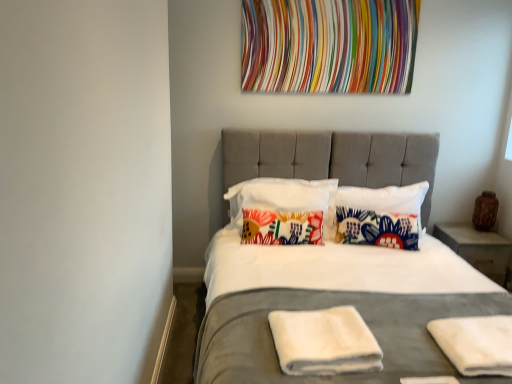
Question: From the image's perspective, would you say white towel at center, which is counted as the 1th material, starting from the left, is positioned over white cotton pillow at center, which is the third pillow in right-to-left order?

Choices:
 (A) no
 (B) yes

Answer: (A)

Question: Does white towel at center, arranged as the second material when viewed from the right, turn towards white cotton pillow at center, the 2th pillow when ordered from left to right?

Choices:
 (A) no
 (B) yes

Answer: (A)

Question: Considering the relative sizes of white towel at center, arranged as the second material when viewed from the right, and white cotton pillow at center, the 2th pillow when ordered from left to right, in the image provided, is white towel at center, arranged as the second material when viewed from the right, taller than white cotton pillow at center, the 2th pillow when ordered from left to right,?

Choices:
 (A) no
 (B) yes

Answer: (A)

Question: Does white towel at center, which is counted as the 1th material, starting from the left, have a lesser height compared to white cotton pillow at center, the 2th pillow when ordered from left to right?

Choices:
 (A) yes
 (B) no

Answer: (A)

Question: From the image's perspective, is white towel at center, which is counted as the 1th material, starting from the left, beneath white cotton pillow at center, the 2th pillow when ordered from left to right?

Choices:
 (A) no
 (B) yes

Answer: (B)

Question: Does point (373, 236) appear closer or farther from the camera than point (474, 347)?

Choices:
 (A) farther
 (B) closer

Answer: (A)

Question: Do you think floral fabric pillow at center, the 2th pillow from the right, is within white soft towel at lower right, the 2th material viewed from the left, or outside of it?

Choices:
 (A) inside
 (B) outside

Answer: (B)

Question: Looking at their shapes, would you say floral fabric pillow at center, the 2th pillow from the right, is wider or thinner than white soft towel at lower right, the 2th material viewed from the left?

Choices:
 (A) wide
 (B) thin

Answer: (B)

Question: Considering the positions of floral fabric pillow at center, the 2th pillow from the right, and white soft towel at lower right, acting as the 1th material starting from the right, in the image, is floral fabric pillow at center, the 2th pillow from the right, taller or shorter than white soft towel at lower right, acting as the 1th material starting from the right,?

Choices:
 (A) short
 (B) tall

Answer: (B)

Question: From the image's perspective, is concrete/rough nightstand at right above or below white soft towel at lower right, the 2th material viewed from the left?

Choices:
 (A) below
 (B) above

Answer: (B)

Question: From a real-world perspective, is concrete/rough nightstand at right positioned above or below white soft towel at lower right, the 2th material viewed from the left?

Choices:
 (A) above
 (B) below

Answer: (B)

Question: Looking at their shapes, would you say concrete/rough nightstand at right is wider or thinner than white soft towel at lower right, the 2th material viewed from the left?

Choices:
 (A) thin
 (B) wide

Answer: (B)

Question: Is point (475, 256) positioned closer to the camera than point (507, 354)?

Choices:
 (A) farther
 (B) closer

Answer: (A)

Question: From a real-world perspective, relative to floral fabric pillow at center, the 2th pillow from the right, is multicolored fabric at upper center vertically above or below?

Choices:
 (A) above
 (B) below

Answer: (A)

Question: Relative to floral fabric pillow at center, which is the third pillow in left-to-right order, is multicolored fabric at upper center in front or behind?

Choices:
 (A) behind
 (B) front

Answer: (A)